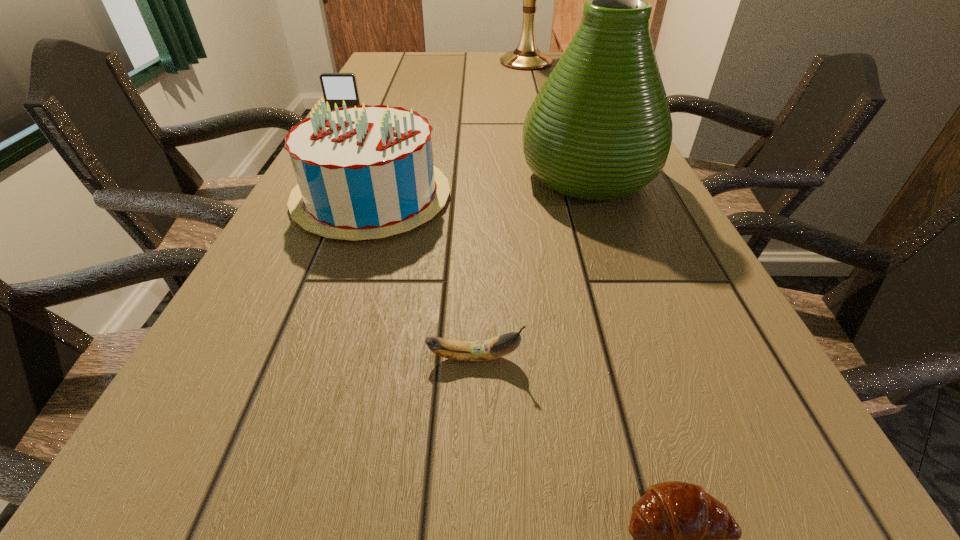
Locate an element on the screen. vacant position located 0.380m on the right of the fourth shortest object is located at coordinates (636, 197).

Where is `blank space located 0.180m on the front-facing side of the fourth tallest object`? Image resolution: width=960 pixels, height=540 pixels. blank space located 0.180m on the front-facing side of the fourth tallest object is located at coordinates (330, 165).

Find the location of a particular element. The height and width of the screenshot is (540, 960). vacant space situated on the peel of the banana is located at coordinates (661, 357).

Locate an element on the screen. object that is positioned at the far edge is located at coordinates (526, 56).

Where is `birthday cake present at the left edge`? The image size is (960, 540). birthday cake present at the left edge is located at coordinates (365, 172).

At what (x,y) coordinates should I click in order to perform the action: click on iPod that is positioned at the left edge. Please return your answer as a coordinate pair (x, y). The width and height of the screenshot is (960, 540). Looking at the image, I should click on (336, 87).

Locate an element on the screen. The image size is (960, 540). trophy cup that is positioned at the right edge is located at coordinates (526, 56).

Image resolution: width=960 pixels, height=540 pixels. Find the location of `vase present at the right edge`. vase present at the right edge is located at coordinates (600, 128).

Where is `object that is at the far right corner`? object that is at the far right corner is located at coordinates tap(526, 56).

What are the coordinates of `blank area at the far edge` in the screenshot? It's located at pos(440,57).